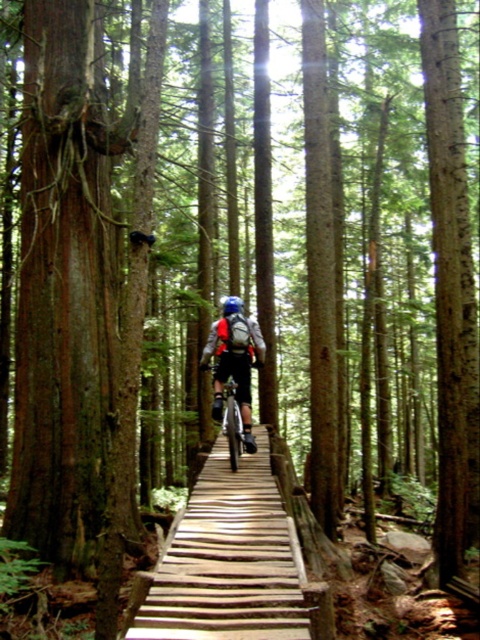
You are a hiker who wants to cross the wooden planks bridge at center with your 20 kg backpack. Considering the silver metallic mountain bike at center is already on the bridge, is the bridge wide enough for both you and the bike to pass safely?

The wooden planks bridge at center is closer to the viewer than the silver metallic mountain bike at center, which means the bridge is narrower than the bike. Therefore, it might not be safe to cross with your backpack.